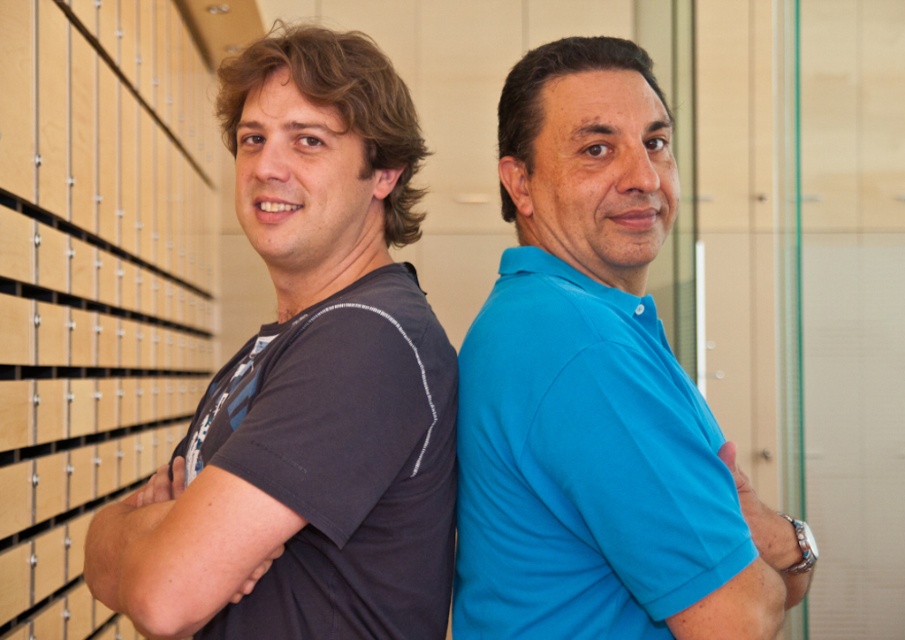
Question: Does wooden at left appear under blue smooth shirt at right?

Choices:
 (A) yes
 (B) no

Answer: (B)

Question: Is wooden at left below blue smooth shirt at right?

Choices:
 (A) no
 (B) yes

Answer: (A)

Question: Can you confirm if blue smooth polo shirt at center is positioned to the left of metallic silver watch at right?

Choices:
 (A) no
 (B) yes

Answer: (B)

Question: Which of the following is the closest to the observer?

Choices:
 (A) dark gray t-shirt at left
 (B) metallic silver watch at right
 (C) blue smooth shirt at right

Answer: (C)

Question: Which point is farther from the camera taking this photo?

Choices:
 (A) (399, 532)
 (B) (32, 192)

Answer: (B)

Question: Which point is closer to the camera?

Choices:
 (A) wooden at left
 (B) blue smooth polo shirt at center
 (C) dark gray fabric at left
 (D) dark gray t-shirt at left

Answer: (B)